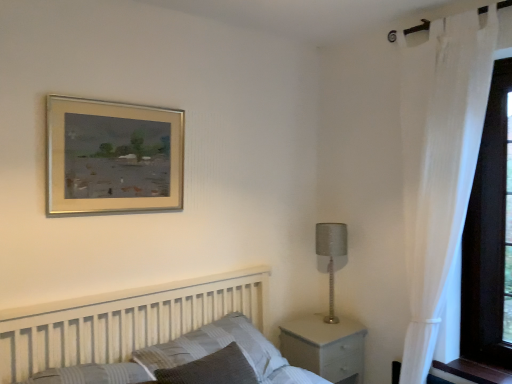
Question: Is white wooden bed at lower left at the left side of striped fabric pillow at center?

Choices:
 (A) yes
 (B) no

Answer: (B)

Question: Is white wooden bed at lower left taller than striped fabric pillow at center?

Choices:
 (A) yes
 (B) no

Answer: (A)

Question: Is the depth of white wooden bed at lower left less than that of striped fabric pillow at center?

Choices:
 (A) yes
 (B) no

Answer: (A)

Question: From the image's perspective, does white wooden bed at lower left appear lower than striped fabric pillow at center?

Choices:
 (A) yes
 (B) no

Answer: (B)

Question: Is white wooden bed at lower left shorter than striped fabric pillow at center?

Choices:
 (A) no
 (B) yes

Answer: (A)

Question: From a real-world perspective, is gold metallic picture frame at upper center physically located above or below satin silver lamp at right?

Choices:
 (A) above
 (B) below

Answer: (A)

Question: In terms of height, does gold metallic picture frame at upper center look taller or shorter compared to satin silver lamp at right?

Choices:
 (A) short
 (B) tall

Answer: (A)

Question: Is point (130, 148) positioned closer to the camera than point (321, 236)?

Choices:
 (A) farther
 (B) closer

Answer: (B)

Question: Based on their positions, is gold metallic picture frame at upper center located to the left or right of satin silver lamp at right?

Choices:
 (A) right
 (B) left

Answer: (B)

Question: Based on their positions, is white wooden bed at lower left located to the left or right of white sheer curtain at right?

Choices:
 (A) left
 (B) right

Answer: (A)

Question: Is point (103, 309) positioned closer to the camera than point (472, 153)?

Choices:
 (A) farther
 (B) closer

Answer: (B)

Question: From the image's perspective, relative to white sheer curtain at right, is white wooden bed at lower left above or below?

Choices:
 (A) below
 (B) above

Answer: (A)

Question: In terms of width, does white wooden bed at lower left look wider or thinner when compared to white sheer curtain at right?

Choices:
 (A) wide
 (B) thin

Answer: (A)

Question: From a real-world perspective, is satin silver lamp at right positioned above or below striped fabric pillow at center?

Choices:
 (A) above
 (B) below

Answer: (A)

Question: From the image's perspective, is satin silver lamp at right located above or below striped fabric pillow at center?

Choices:
 (A) above
 (B) below

Answer: (A)